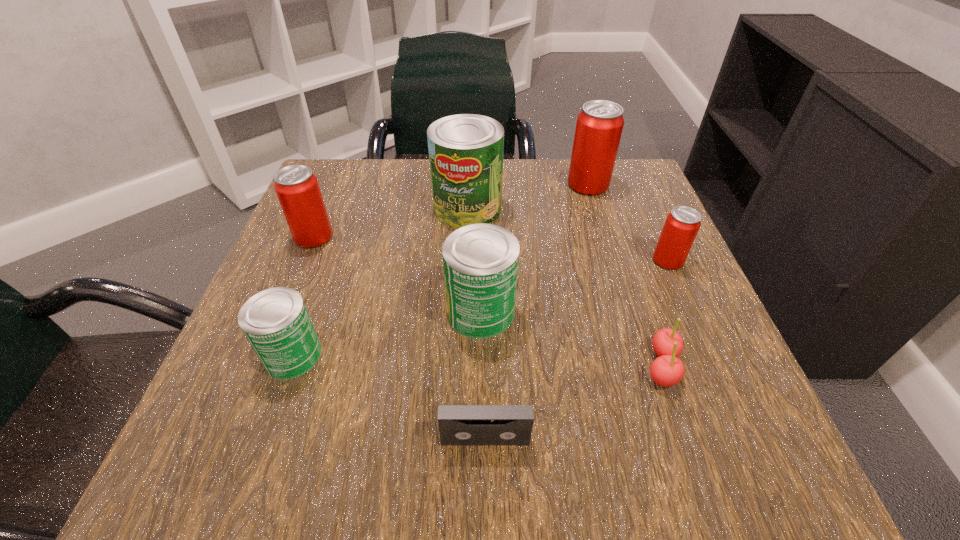
In order to click on red can that stands as the second closest to the biggest green can in this screenshot , I will do `click(297, 188)`.

Find the location of a particular element. This screenshot has height=540, width=960. green can that is the closest to the videotape is located at coordinates (480, 261).

Choose which green can is the second nearest neighbor to the leftmost red can. Please provide its 2D coordinates. Your answer should be formatted as a tuple, i.e. [(x, y)], where the tuple contains the x and y coordinates of a point satisfying the conditions above.

[(275, 321)]

Find the location of `blank area in the image that satisfies the following two spatial constraints: 1. on the back side of the biggest green can; 2. on the left side of the second nearest red can`. blank area in the image that satisfies the following two spatial constraints: 1. on the back side of the biggest green can; 2. on the left side of the second nearest red can is located at coordinates (325, 208).

At what (x,y) coordinates should I click in order to perform the action: click on free space that satisfies the following two spatial constraints: 1. on the front side of the cherry; 2. on the left side of the farthest green can. Please return your answer as a coordinate pair (x, y). The width and height of the screenshot is (960, 540). Looking at the image, I should click on (462, 366).

Locate an element on the screen. This screenshot has width=960, height=540. vacant area in the image that satisfies the following two spatial constraints: 1. on the back side of the farthest green can; 2. on the right side of the leftmost red can is located at coordinates (325, 208).